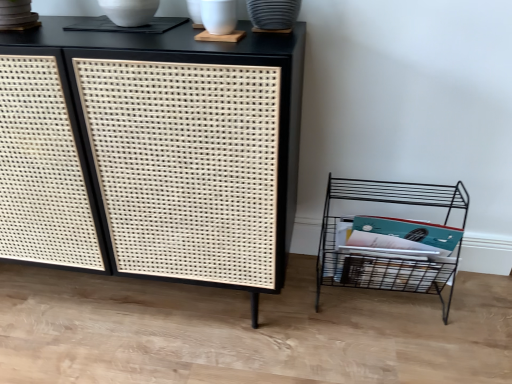
Question: Considering the relative sizes of black woven cabinet at center and black wire shelf at lower right in the image provided, is black woven cabinet at center bigger than black wire shelf at lower right?

Choices:
 (A) yes
 (B) no

Answer: (A)

Question: Could you tell me if black woven cabinet at center is facing black wire shelf at lower right?

Choices:
 (A) no
 (B) yes

Answer: (A)

Question: From a real-world perspective, does black woven cabinet at center sit lower than black wire shelf at lower right?

Choices:
 (A) yes
 (B) no

Answer: (B)

Question: Considering the relative positions of black woven cabinet at center and black wire shelf at lower right in the image provided, is black woven cabinet at center in front of black wire shelf at lower right?

Choices:
 (A) no
 (B) yes

Answer: (B)

Question: Is black woven cabinet at center further to the viewer compared to black wire shelf at lower right?

Choices:
 (A) no
 (B) yes

Answer: (A)

Question: Is black wire shelf at lower right completely or partially inside black woven cabinet at center?

Choices:
 (A) yes
 (B) no

Answer: (B)

Question: Could you tell me if black wire shelf at lower right is turned towards black woven cabinet at center?

Choices:
 (A) yes
 (B) no

Answer: (B)

Question: Is black wire shelf at lower right further to the viewer compared to black woven cabinet at center?

Choices:
 (A) no
 (B) yes

Answer: (B)

Question: Can you confirm if black wire shelf at lower right is smaller than black woven cabinet at center?

Choices:
 (A) no
 (B) yes

Answer: (B)

Question: Is black wire shelf at lower right to the right of black woven cabinet at center from the viewer's perspective?

Choices:
 (A) yes
 (B) no

Answer: (A)

Question: From the image's perspective, is black wire shelf at lower right on top of black woven cabinet at center?

Choices:
 (A) no
 (B) yes

Answer: (A)

Question: From a real-world perspective, is black wire shelf at lower right physically below black woven cabinet at center?

Choices:
 (A) no
 (B) yes

Answer: (B)

Question: Does point (411, 273) appear closer or farther from the camera than point (89, 190)?

Choices:
 (A) farther
 (B) closer

Answer: (A)